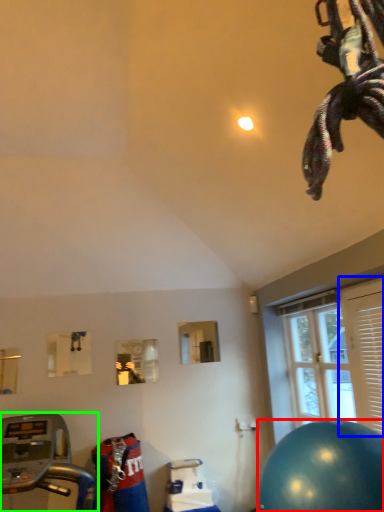
Question: Which object is positioned farthest from ball (highlighted by a red box)? Select from shutter (highlighted by a blue box) and treadmill (highlighted by a green box).

Choices:
 (A) shutter
 (B) treadmill

Answer: (B)